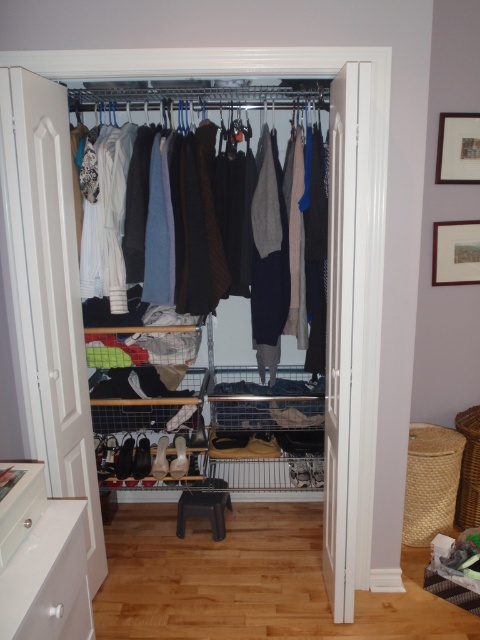
Question: Is metallic wire rack at center positioned before knit sweater at center?

Choices:
 (A) yes
 (B) no

Answer: (A)

Question: Can you confirm if metallic wire rack at center is positioned below knit sweater at center?

Choices:
 (A) no
 (B) yes

Answer: (B)

Question: Is metallic wire rack at center above knit sweater at center?

Choices:
 (A) no
 (B) yes

Answer: (A)

Question: Which object is closer to the camera taking this photo?

Choices:
 (A) metallic wire rack at center
 (B) knit sweater at center

Answer: (A)

Question: Among these points, which one is nearest to the camera?

Choices:
 (A) [x=193, y=156]
 (B) [x=310, y=60]

Answer: (B)